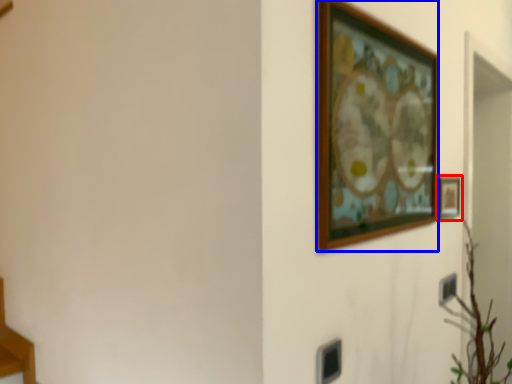
Question: Which object is closer to the camera taking this photo, picture frame (highlighted by a red box) or picture frame (highlighted by a blue box)?

Choices:
 (A) picture frame
 (B) picture frame

Answer: (B)